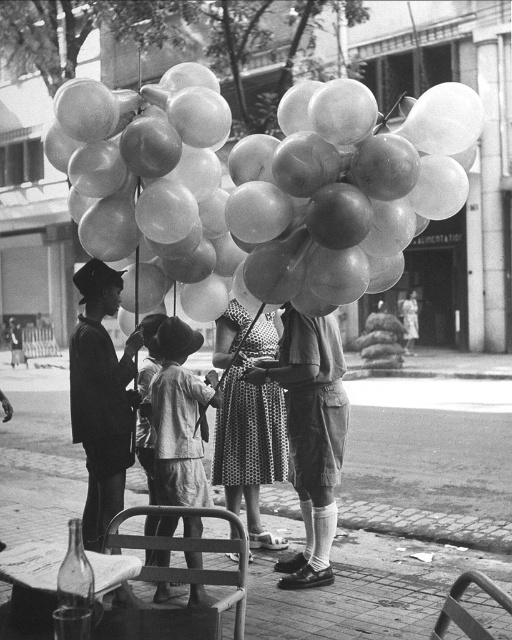
Which is more to the left, translucent rubber balloons at center or matte khaki shorts at center?

From the viewer's perspective, translucent rubber balloons at center appears more on the left side.

Between translucent rubber balloons at center and matte khaki shorts at center, which one appears on the right side from the viewer's perspective?

Positioned to the right is matte khaki shorts at center.

Is point (298, 289) positioned in front of point (320, 410)?

Yes, it is in front of point (320, 410).

Locate an element on the screen. The width and height of the screenshot is (512, 640). translucent rubber balloons at center is located at coordinates (266, 180).

Between matte khaki shorts at center and polka dot dress at center, which one appears on the left side from the viewer's perspective?

polka dot dress at center is more to the left.

Does matte khaki shorts at center appear on the right side of polka dot dress at center?

Indeed, matte khaki shorts at center is positioned on the right side of polka dot dress at center.

The image size is (512, 640). Identify the location of matte khaki shorts at center. (310, 433).

Can you confirm if dark suit at center is smaller than polka dot dress at center?

Indeed, dark suit at center has a smaller size compared to polka dot dress at center.

Between dark suit at center and polka dot dress at center, which one is positioned lower?

dark suit at center

The image size is (512, 640). What do you see at coordinates (100, 397) in the screenshot? I see `dark suit at center` at bounding box center [100, 397].

Where is `dark suit at center`? Image resolution: width=512 pixels, height=640 pixels. dark suit at center is located at coordinates (100, 397).